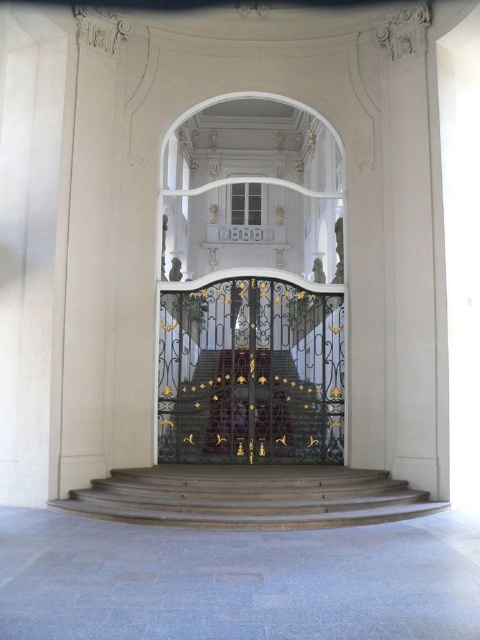
Does wooden stairs at center appear on the right side of white marble balustrade at center?

Yes, wooden stairs at center is to the right of white marble balustrade at center.

Which is more to the right, wooden stairs at center or white marble balustrade at center?

wooden stairs at center

Between point (279, 492) and point (231, 240), which one is positioned in front?

Point (279, 492) is more forward.

Where is `wooden stairs at center`? This screenshot has height=640, width=480. wooden stairs at center is located at coordinates (250, 497).

This screenshot has width=480, height=640. Describe the element at coordinates (252, 291) in the screenshot. I see `gold wrought iron gate at center` at that location.

Can you confirm if gold wrought iron gate at center is bigger than gold ornate staircase at center?

Yes.

The width and height of the screenshot is (480, 640). Identify the location of gold wrought iron gate at center. (252, 291).

In the scene shown: Can you confirm if wooden stairs at center is positioned above gold ornate staircase at center?

No.

What do you see at coordinates (250, 497) in the screenshot?
I see `wooden stairs at center` at bounding box center [250, 497].

Where is `wooden stairs at center`? Image resolution: width=480 pixels, height=640 pixels. wooden stairs at center is located at coordinates (250, 497).